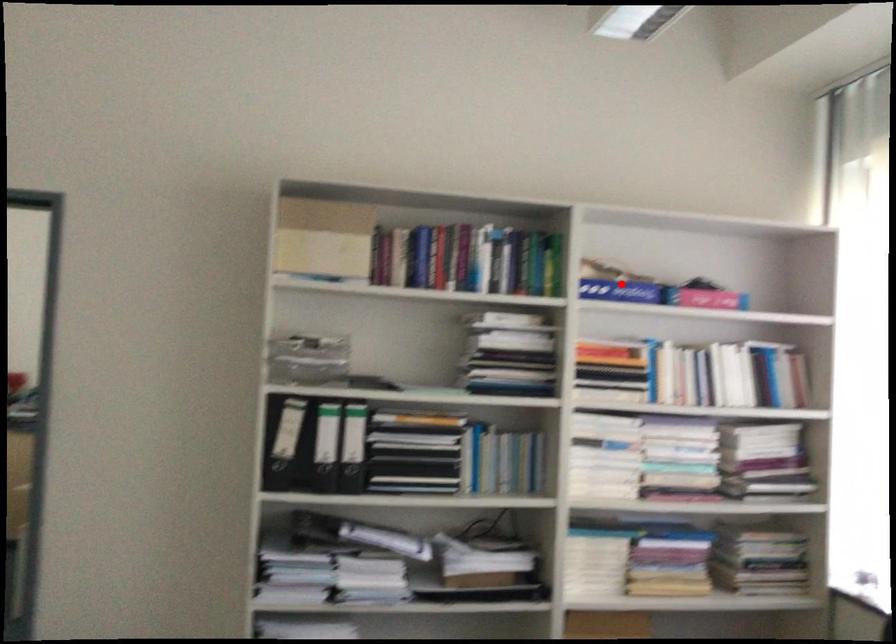
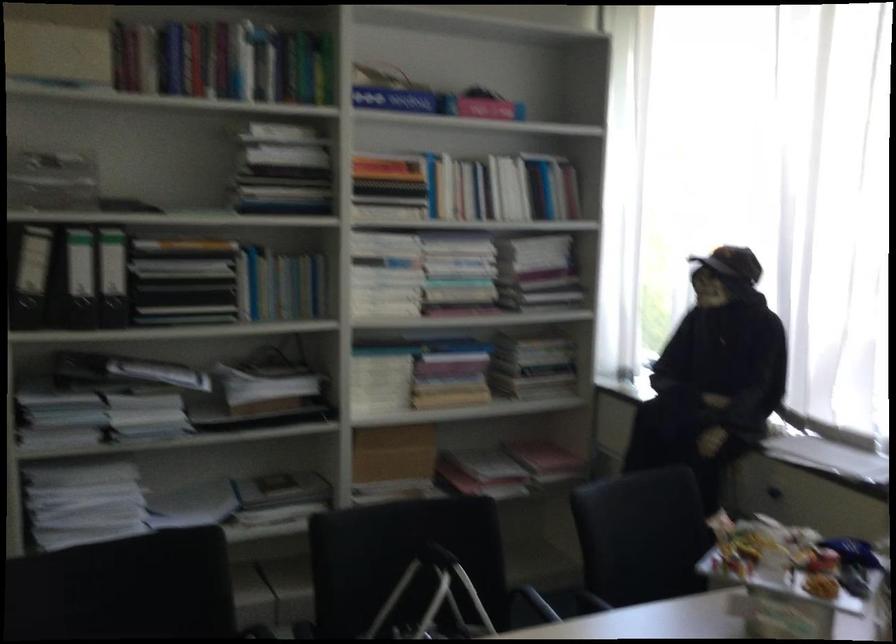
Question: I am providing you with two images of the same scene from different viewpoints. A red point is marked on the first image. At the location where the point appears in image 1, is it still visible in image 2?

Choices:
 (A) Yes
 (B) No

Answer: (A)